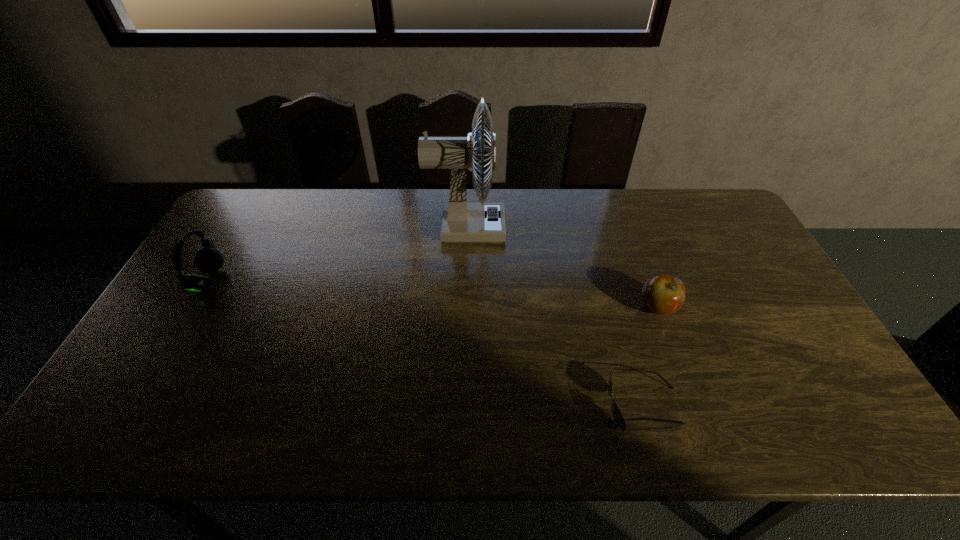
Locate an element on the screen. fan is located at coordinates (461, 222).

Find the location of a particular element. The height and width of the screenshot is (540, 960). the farthest object is located at coordinates (461, 222).

The height and width of the screenshot is (540, 960). I want to click on headset, so click(x=208, y=259).

In order to click on the second tallest object in this screenshot , I will do `click(208, 259)`.

Where is `apple`? The image size is (960, 540). apple is located at coordinates (663, 294).

What are the coordinates of `sunglasses` in the screenshot? It's located at (617, 415).

I want to click on the shortest object, so click(617, 415).

Locate an element on the screen. This screenshot has height=540, width=960. free space located 0.200m on the front-facing side of the fan is located at coordinates pyautogui.click(x=564, y=228).

In order to click on free space located 0.140m on the ear cups of the leftmost object in this screenshot , I will do `click(269, 280)`.

Locate an element on the screen. vacant region located 0.240m on the back of the third tallest object is located at coordinates (633, 240).